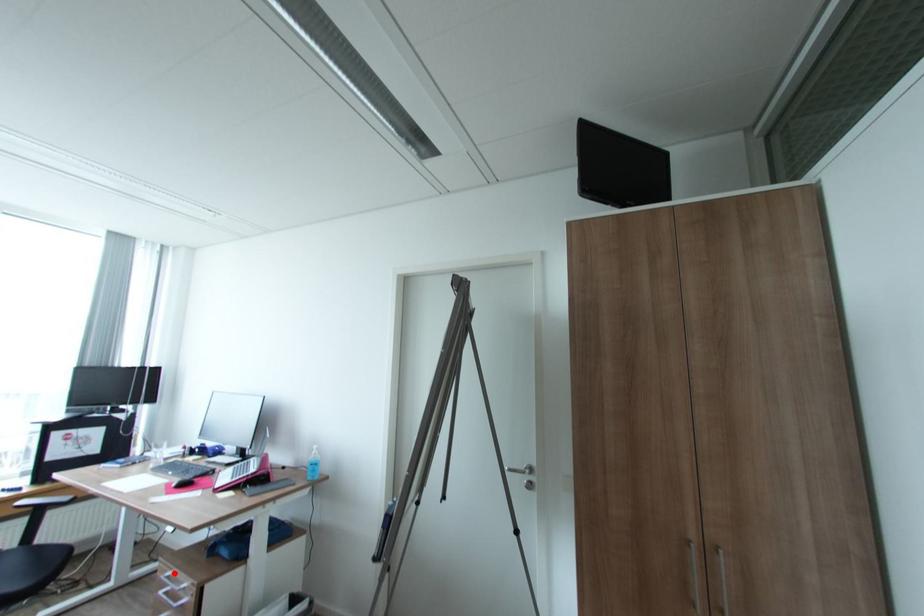
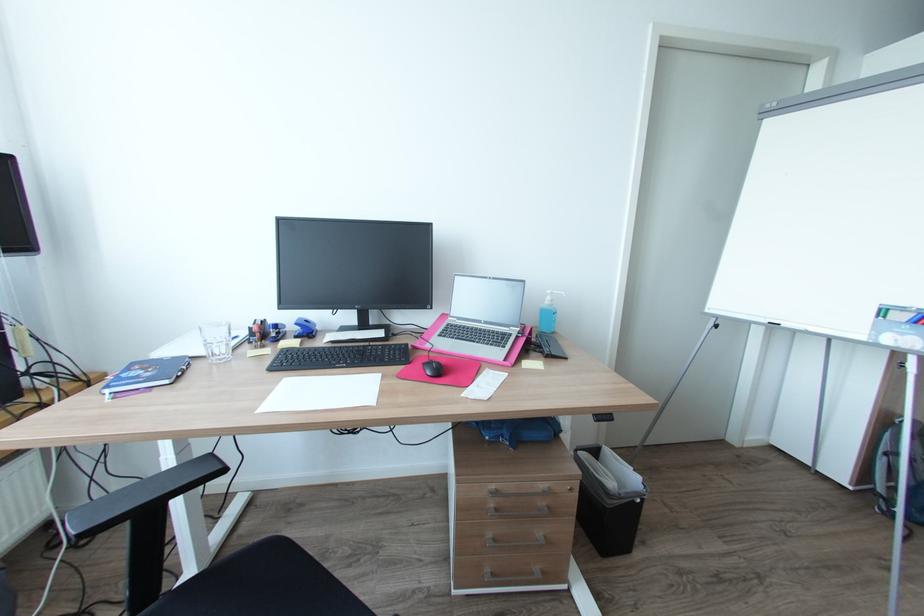
In the second image, find the point that corresponds to the highlighted location in the first image.

(497, 487)